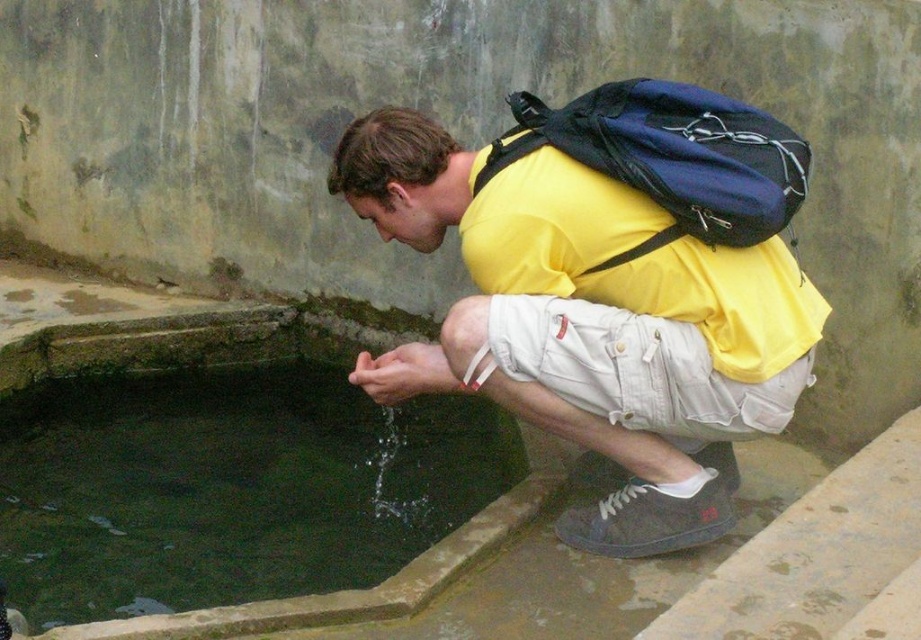
Question: Among these points, which one is nearest to the camera?

Choices:
 (A) (626, 420)
 (B) (414, 346)

Answer: (A)

Question: Which is farther from the green stone pool at lower left?

Choices:
 (A) white denim shorts at lower center
 (B) yellow matte shirt at center
 (C) blue fabric backpack at upper center

Answer: (C)

Question: Can you confirm if yellow matte shirt at center is positioned to the right of green stone pool at lower left?

Choices:
 (A) no
 (B) yes

Answer: (B)

Question: Which object is closer to the camera taking this photo?

Choices:
 (A) green stone pool at lower left
 (B) blue fabric backpack at upper center
 (C) yellow matte shirt at center

Answer: (B)

Question: Is green stone pool at lower left positioned at the back of white denim shorts at lower center?

Choices:
 (A) no
 (B) yes

Answer: (B)

Question: Is green stone pool at lower left positioned in front of white denim shorts at lower center?

Choices:
 (A) no
 (B) yes

Answer: (A)